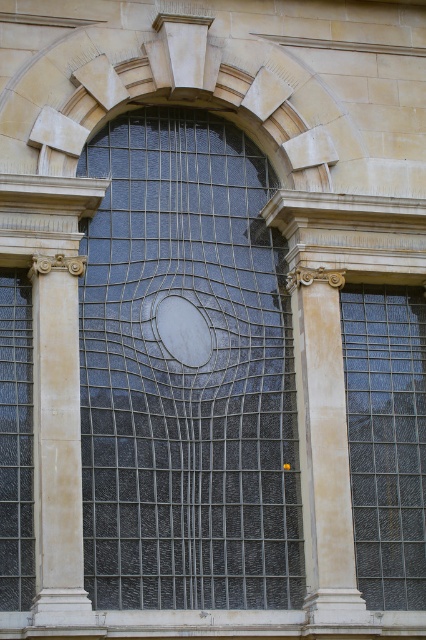
You are an architect designing a new building and want to replicate the facade shown. You need to ensure the smooth stone pillar at right and the clear glass window at left are proportionate. Based on the image, which object is wider?

The smooth stone pillar at right is wider than the clear glass window at left according to the description.

You are an architect inspecting the building facade. You notice the dark gray textured glass at center and the smooth stone pillar at right. Which object is positioned closer to the left side of the facade?

The dark gray textured glass at center is positioned closer to the left side of the facade compared to the smooth stone pillar at right, as it is located to the left of it.